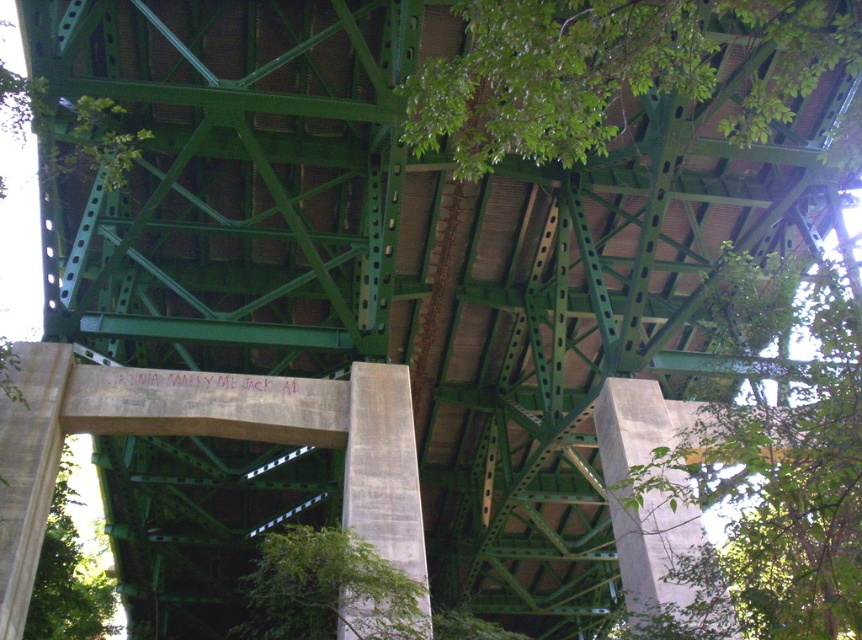
Is green leafy tree at center to the right of green leafy tree at upper right from the viewer's perspective?

Correct, you'll find green leafy tree at center to the right of green leafy tree at upper right.

Is green leafy tree at center behind green leafy tree at upper right?

No, it is not.

What do you see at coordinates (769, 467) in the screenshot?
I see `green leafy tree at center` at bounding box center [769, 467].

Locate an element on the screen. green leafy tree at center is located at coordinates (769, 467).

The height and width of the screenshot is (640, 862). What are the coordinates of `green leafy tree at lower center` in the screenshot? It's located at (329, 589).

Between point (846, 426) and point (52, 636), which one is positioned in front?

Point (846, 426)

Who is shorter, green leafy tree at center or green leafy tree at lower left?

green leafy tree at center

Where is `green leafy tree at center`? This screenshot has width=862, height=640. green leafy tree at center is located at coordinates (769, 467).

You are a GUI agent. You are given a task and a screenshot of the screen. Output one action in this format:
    pyautogui.click(x=<x>, y=<y>)
    Task: Click on the green leafy tree at center
    
    Given the screenshot: What is the action you would take?
    pyautogui.click(x=769, y=467)